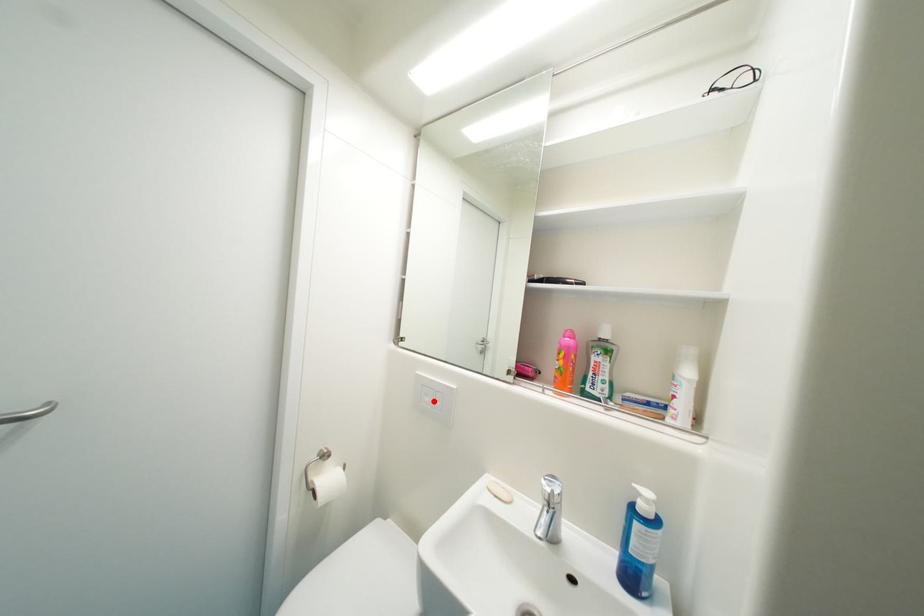
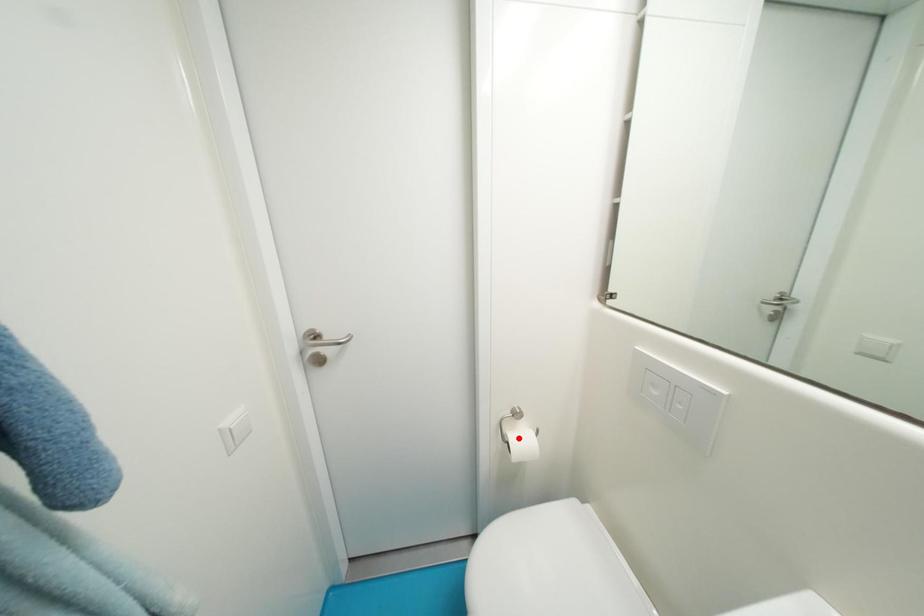
I am providing you with two images of the same scene from different viewpoints. A red point is marked on the first image and another point is marked on the second image. Is the red point in image1 aligned with the point shown in image2?

No